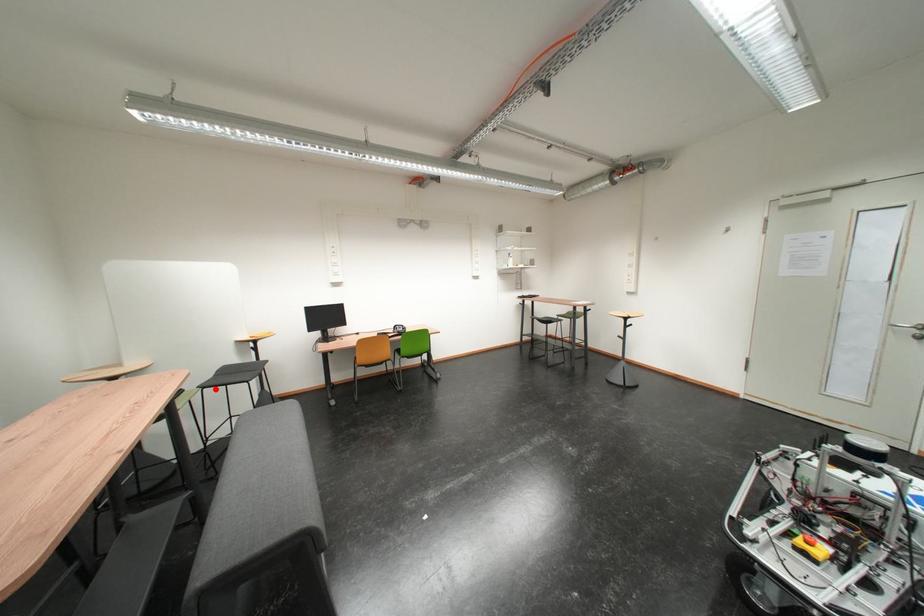
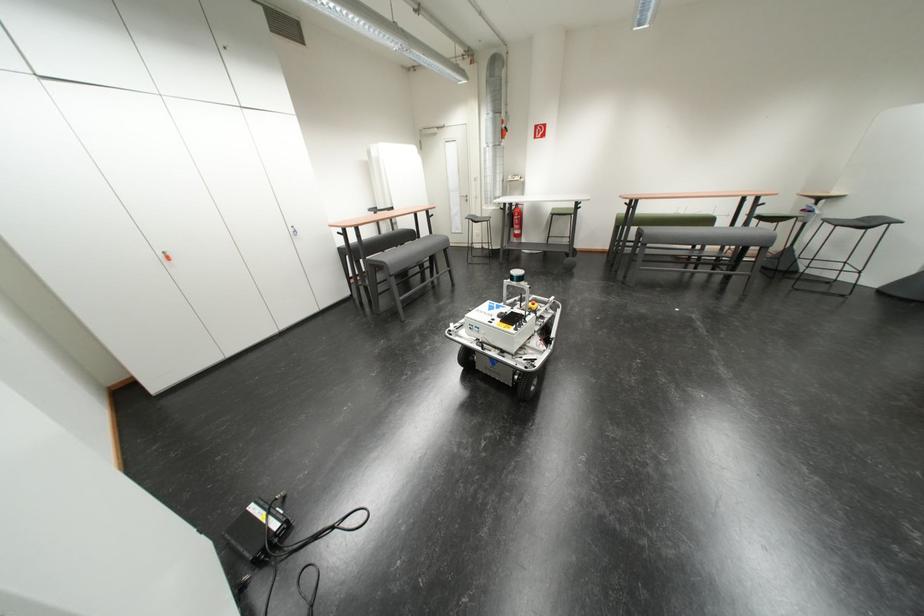
Where in the second image is the point corresponding to the highlighted location from the first image?

(837, 223)